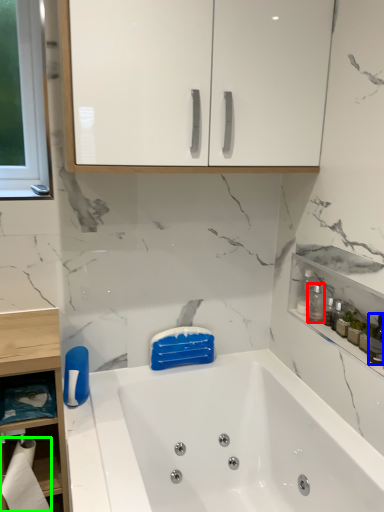
Question: Which object is the farthest from cleaning product (highlighted by a red box)? Choose among these: toiletry (highlighted by a blue box) or toilet paper (highlighted by a green box).

Choices:
 (A) toiletry
 (B) toilet paper

Answer: (B)